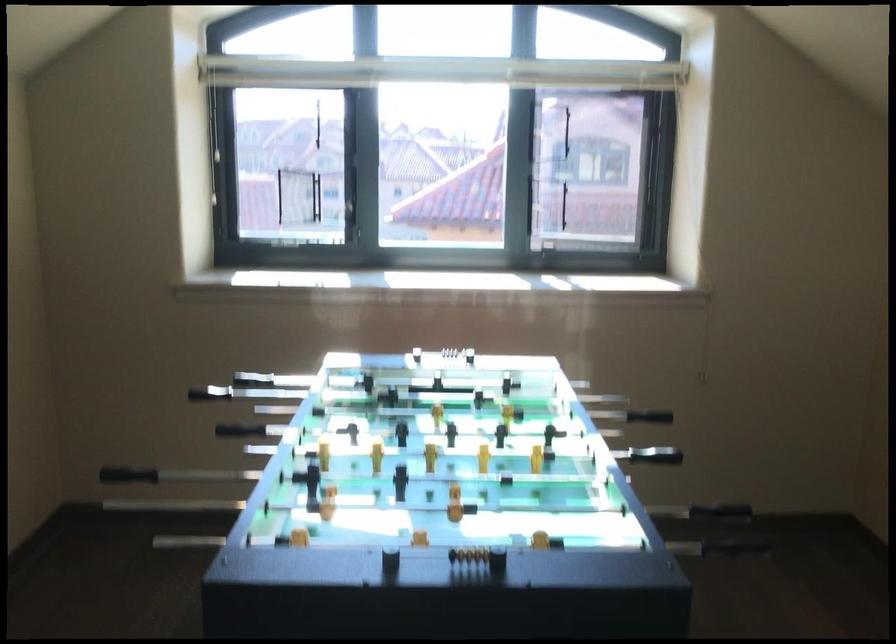
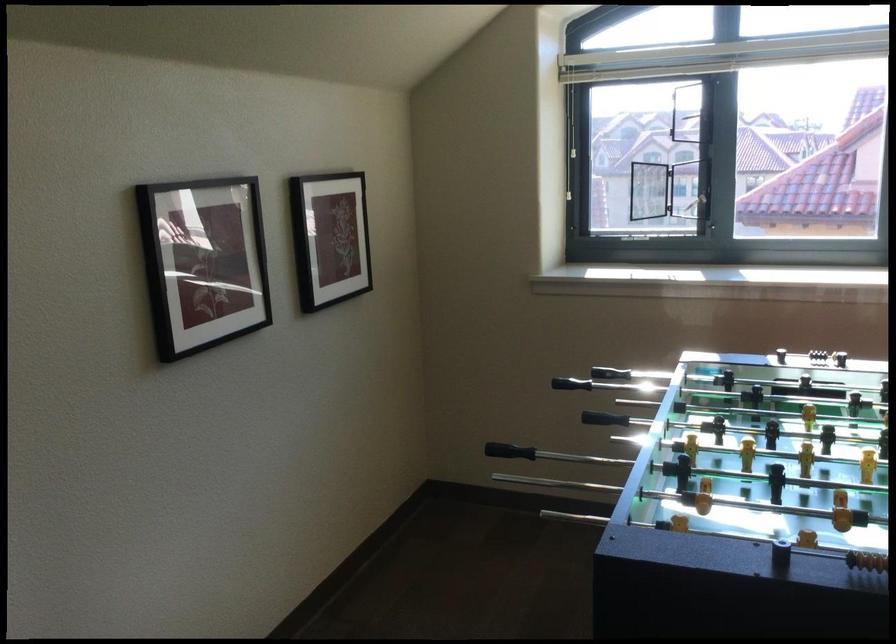
Find the pixel in the second image that matches point 328,124 in the first image.

(692, 116)